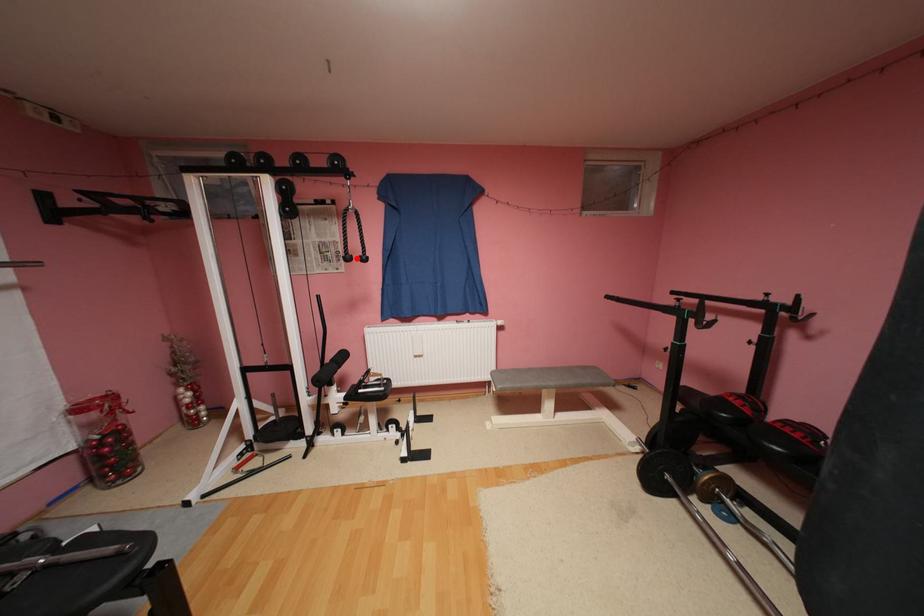
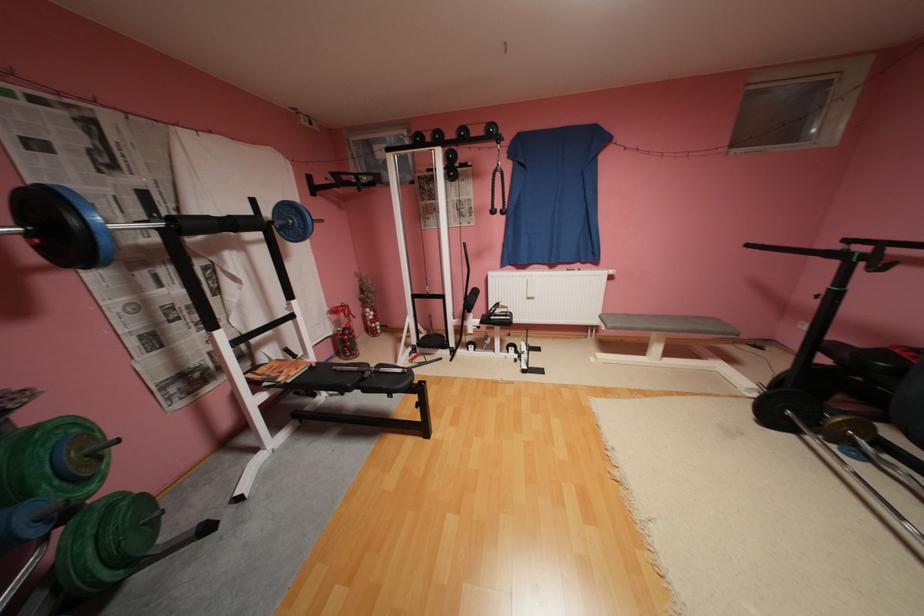
Locate, in the second image, the point that corresponds to the highlighted location in the first image.

(502, 212)